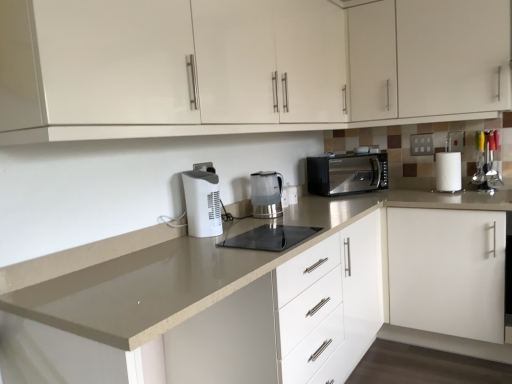
Image resolution: width=512 pixels, height=384 pixels. Describe the element at coordinates (428, 57) in the screenshot. I see `white glossy cabinet at upper center, which is the first cabinetry from top to bottom` at that location.

This screenshot has height=384, width=512. Describe the element at coordinates (270, 237) in the screenshot. I see `black glass cooktop at center` at that location.

Measure the distance between point (263, 232) and camera.

A distance of 5.75 feet exists between point (263, 232) and camera.

The image size is (512, 384). What are the coordinates of `white glossy cabinet at upper center, which is counted as the second cabinetry, starting from the top` in the screenshot? It's located at (246, 66).

Measure the distance between white plastic humidifier at center, the first home appliance viewed from the front, and camera.

white plastic humidifier at center, the first home appliance viewed from the front, is 5.90 feet away from camera.

You are a GUI agent. You are given a task and a screenshot of the screen. Output one action in this format:
    pyautogui.click(x=<x>, y=<y>)
    Task: Click on the white plastic humidifier at center, which appears as the second home appliance when viewed from the back
    
    Given the screenshot: What is the action you would take?
    pyautogui.click(x=202, y=203)

What do you see at coordinates (347, 174) in the screenshot? The height and width of the screenshot is (384, 512). I see `black metallic microwave at upper right` at bounding box center [347, 174].

At what (x,y) coordinates should I click in order to perform the action: click on white matte paper towel at right. Please return your answer as a coordinate pair (x, y). This screenshot has width=512, height=384. Looking at the image, I should click on (448, 172).

Between black metallic microwave at upper right and white glossy cabinet at upper center, which is counted as the 2th cabinetry, starting from the bottom, which one has larger size?

white glossy cabinet at upper center, which is counted as the 2th cabinetry, starting from the bottom.

The image size is (512, 384). Find the location of `kitchen appliance lying on the right of white glossy cabinet at upper center, which is counted as the 2th cabinetry, starting from the bottom`. kitchen appliance lying on the right of white glossy cabinet at upper center, which is counted as the 2th cabinetry, starting from the bottom is located at coordinates (347, 174).

From the image's perspective, is black metallic microwave at upper right located above or below white glossy cabinet at upper center, which is counted as the second cabinetry, starting from the top?

Clearly, from the image's perspective, black metallic microwave at upper right is below white glossy cabinet at upper center, which is counted as the second cabinetry, starting from the top.

Is black metallic microwave at upper right positioned with its back to white glossy cabinet at upper center, which is counted as the 2th cabinetry, starting from the bottom?

No, black metallic microwave at upper right is not facing the opposite direction of white glossy cabinet at upper center, which is counted as the 2th cabinetry, starting from the bottom.

From the image's perspective, which object appears higher, white glossy cabinet at upper center, arranged as the 3th cabinetry when ordered from the bottom, or white plastic humidifier at center, the first home appliance viewed from the front?

white glossy cabinet at upper center, arranged as the 3th cabinetry when ordered from the bottom, from the image's perspective.

Does white glossy cabinet at upper center, which is the first cabinetry from top to bottom, turn towards white plastic humidifier at center, which appears as the second home appliance when viewed from the back?

Yes, white glossy cabinet at upper center, which is the first cabinetry from top to bottom, is aimed at white plastic humidifier at center, which appears as the second home appliance when viewed from the back.

From a real-world perspective, is white glossy cabinet at upper center, which is the first cabinetry from top to bottom, positioned over white plastic humidifier at center, which appears as the first home appliance when viewed from the left, based on gravity?

Yes, from a real-world perspective, white glossy cabinet at upper center, which is the first cabinetry from top to bottom, is above white plastic humidifier at center, which appears as the first home appliance when viewed from the left.

Does white glossy cabinet at upper center, arranged as the 3th cabinetry when ordered from the bottom, have a larger size compared to white plastic humidifier at center, which appears as the second home appliance when viewed from the back?

Yes, white glossy cabinet at upper center, arranged as the 3th cabinetry when ordered from the bottom, is bigger than white plastic humidifier at center, which appears as the second home appliance when viewed from the back.

Considering the sizes of objects white matte paper towel at right and transparent plastic kettle at center, which is the first home appliance in right-to-left order, in the image provided, who is bigger, white matte paper towel at right or transparent plastic kettle at center, which is the first home appliance in right-to-left order,?

With larger size is transparent plastic kettle at center, which is the first home appliance in right-to-left order.

From the image's perspective, is white matte paper towel at right positioned above or below transparent plastic kettle at center, placed as the first home appliance when sorted from back to front?

From the image's perspective, white matte paper towel at right appears above transparent plastic kettle at center, placed as the first home appliance when sorted from back to front.

In the image, is white matte paper towel at right on the left side or the right side of transparent plastic kettle at center, acting as the second home appliance starting from the front?

In the image, white matte paper towel at right appears on the right side of transparent plastic kettle at center, acting as the second home appliance starting from the front.

From a real-world perspective, which object rests below the other?

In real-world perspective, transparent plastic kettle at center, which is the first home appliance in right-to-left order, is lower.

Is white glossy cabinet at upper center, which is the first cabinetry from top to bottom, closer to the viewer compared to transparent plastic kettle at center, the 2th home appliance viewed from the left?

That is False.

From the picture: From a real-world perspective, is white glossy cabinet at upper center, arranged as the 3th cabinetry when ordered from the bottom, located beneath transparent plastic kettle at center, the 2th home appliance viewed from the left?

No.

Do you think white glossy cabinet at upper center, arranged as the 3th cabinetry when ordered from the bottom, is within transparent plastic kettle at center, acting as the second home appliance starting from the front, or outside of it?

white glossy cabinet at upper center, arranged as the 3th cabinetry when ordered from the bottom, is not inside transparent plastic kettle at center, acting as the second home appliance starting from the front, it's outside.

Is point (459, 154) closer or farther from the camera than point (353, 172)?

Point (459, 154).

In the image, is white matte paper towel at right on the left side or the right side of black metallic microwave at upper right?

white matte paper towel at right is to the right of black metallic microwave at upper right.

Is white matte paper towel at right touching black metallic microwave at upper right?

No, white matte paper towel at right is not next to black metallic microwave at upper right.

Considering the sizes of objects white matte paper towel at right and black metallic microwave at upper right in the image provided, who is shorter, white matte paper towel at right or black metallic microwave at upper right?

white matte paper towel at right is shorter.

Does point (438, 191) appear closer or farther from the camera than point (482, 280)?

Clearly, point (438, 191) is more distant from the camera than point (482, 280).

From the image's perspective, does white matte paper towel at right appear higher than white matte cabinet at right, placed as the 3th cabinetry when sorted from top to bottom?

Yes, from the image's perspective, white matte paper towel at right is above white matte cabinet at right, placed as the 3th cabinetry when sorted from top to bottom.

Looking at this image, which object is closer to the camera, white matte paper towel at right or white matte cabinet at right, which ranks as the 1th cabinetry in bottom-to-top order?

white matte cabinet at right, which ranks as the 1th cabinetry in bottom-to-top order.

What are the coordinates of `cabinetry lying on the left of black metallic microwave at upper right` in the screenshot? It's located at (246, 66).

Is point (113, 69) closer or farther from the camera than point (331, 165)?

Point (113, 69).

Which object is positioned more to the right, white glossy cabinet at upper center, which is counted as the second cabinetry, starting from the top, or black metallic microwave at upper right?

From the viewer's perspective, black metallic microwave at upper right appears more on the right side.

From the image's perspective, is white glossy cabinet at upper center, which is counted as the 2th cabinetry, starting from the bottom, located above black metallic microwave at upper right?

Indeed, from the image's perspective, white glossy cabinet at upper center, which is counted as the 2th cabinetry, starting from the bottom, is shown above black metallic microwave at upper right.

Where is `kitchen appliance below the white glossy cabinet at upper center, which is counted as the 2th cabinetry, starting from the bottom (from the image's perspective)`? Image resolution: width=512 pixels, height=384 pixels. kitchen appliance below the white glossy cabinet at upper center, which is counted as the 2th cabinetry, starting from the bottom (from the image's perspective) is located at coordinates (347, 174).

From the white glossy cabinet at upper center, arranged as the 3th cabinetry when ordered from the bottom, count 2nd home appliances forward and point to it. Please provide its 2D coordinates.

[(202, 203)]

Based on their spatial positions, is black metallic microwave at upper right or white glossy cabinet at upper center, which is the first cabinetry from top to bottom, further from beige laminate countertop at center?

white glossy cabinet at upper center, which is the first cabinetry from top to bottom, lies further to beige laminate countertop at center than the other object.

Which object lies further to the anchor point transparent plastic kettle at center, acting as the second home appliance starting from the front, black metallic microwave at upper right or white glossy cabinet at upper center, which is the first cabinetry from top to bottom?

Among the two, white glossy cabinet at upper center, which is the first cabinetry from top to bottom, is located further to transparent plastic kettle at center, acting as the second home appliance starting from the front.

Which object lies further to the anchor point black glass cooktop at center, white plastic humidifier at center, the first home appliance viewed from the front, or transparent plastic kettle at center, which is the first home appliance in right-to-left order?

Based on the image, transparent plastic kettle at center, which is the first home appliance in right-to-left order, appears to be further to black glass cooktop at center.

Considering their positions, is black glass cooktop at center positioned closer to white matte paper towel at right than transparent plastic kettle at center, placed as the first home appliance when sorted from back to front?

The object closer to white matte paper towel at right is transparent plastic kettle at center, placed as the first home appliance when sorted from back to front.

Based on their spatial positions, is white matte paper towel at right or white glossy cabinet at upper center, arranged as the 3th cabinetry when ordered from the bottom, closer to black metallic microwave at upper right?

Based on the image, white matte paper towel at right appears to be nearer to black metallic microwave at upper right.

Based on their spatial positions, is white glossy cabinet at upper center, arranged as the 3th cabinetry when ordered from the bottom, or black metallic microwave at upper right closer to white matte cabinet at right, placed as the 3th cabinetry when sorted from top to bottom?

black metallic microwave at upper right lies closer to white matte cabinet at right, placed as the 3th cabinetry when sorted from top to bottom, than the other object.

Consider the image. Estimate the real-world distances between objects in this image. Which object is further from white matte cabinet at right, which ranks as the 1th cabinetry in bottom-to-top order, transparent plastic kettle at center, which is the first home appliance in right-to-left order, or white glossy cabinet at upper center, arranged as the 3th cabinetry when ordered from the bottom?

Based on the image, transparent plastic kettle at center, which is the first home appliance in right-to-left order, appears to be further to white matte cabinet at right, which ranks as the 1th cabinetry in bottom-to-top order.

Which object lies further to the anchor point white plastic humidifier at center, which appears as the second home appliance when viewed from the back, white glossy cabinet at upper center, arranged as the 3th cabinetry when ordered from the bottom, or black glass cooktop at center?

white glossy cabinet at upper center, arranged as the 3th cabinetry when ordered from the bottom, is positioned further to the anchor white plastic humidifier at center, which appears as the second home appliance when viewed from the back.

What are the coordinates of `home appliance between beige laminate countertop at center and transparent plastic kettle at center, which is the first home appliance in right-to-left order, from front to back` in the screenshot? It's located at (202, 203).

Where is `countertop located between white glossy cabinet at upper center, which is counted as the second cabinetry, starting from the top, and white matte paper towel at right in the depth direction`? This screenshot has height=384, width=512. countertop located between white glossy cabinet at upper center, which is counted as the second cabinetry, starting from the top, and white matte paper towel at right in the depth direction is located at coordinates (249, 296).

Identify the location of kitchen appliance that lies between white glossy cabinet at upper center, arranged as the 3th cabinetry when ordered from the bottom, and white matte cabinet at right, placed as the 3th cabinetry when sorted from top to bottom, from top to bottom. Image resolution: width=512 pixels, height=384 pixels. (347, 174).

Identify the location of kitchen appliance between transparent plastic kettle at center, placed as the first home appliance when sorted from back to front, and white matte cabinet at right, which ranks as the 1th cabinetry in bottom-to-top order. (347, 174).